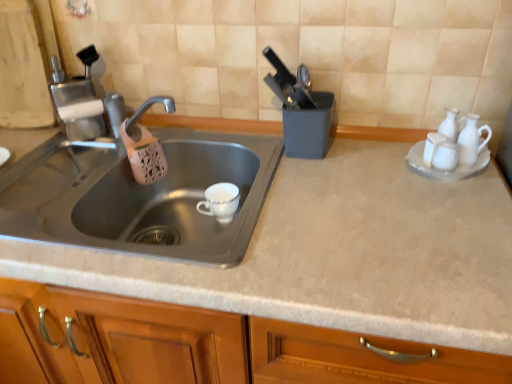
Image resolution: width=512 pixels, height=384 pixels. I want to click on vacant space that is to the left of white ceramic pitcher at right, which ranks as the first tableware in front-to-back order, so click(x=380, y=173).